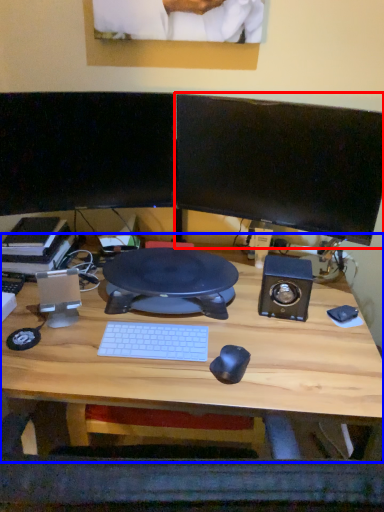
Question: Which object appears farthest to the camera in this image, computer monitor (highlighted by a red box) or desk (highlighted by a blue box)?

Choices:
 (A) computer monitor
 (B) desk

Answer: (A)